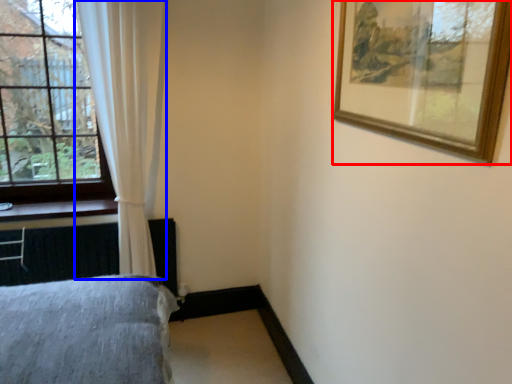
Question: Which point is further to the camera, picture frame (highlighted by a red box) or curtain (highlighted by a blue box)?

Choices:
 (A) picture frame
 (B) curtain

Answer: (B)